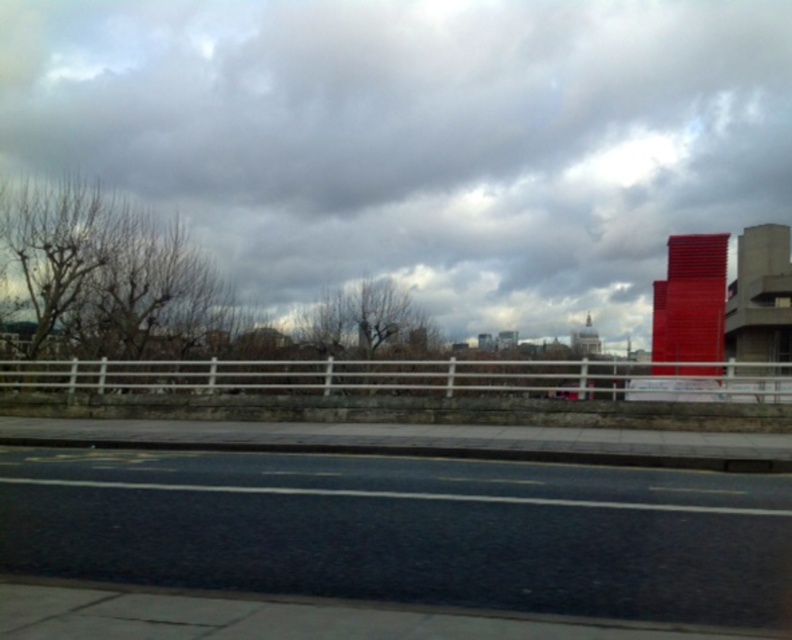
Which is behind, point (219, 24) or point (364, 596)?

The point (219, 24) is behind.

Is cloudy sky at upper center below black asphalt highway at lower center?

Actually, cloudy sky at upper center is above black asphalt highway at lower center.

The image size is (792, 640). I want to click on cloudy sky at upper center, so click(x=417, y=140).